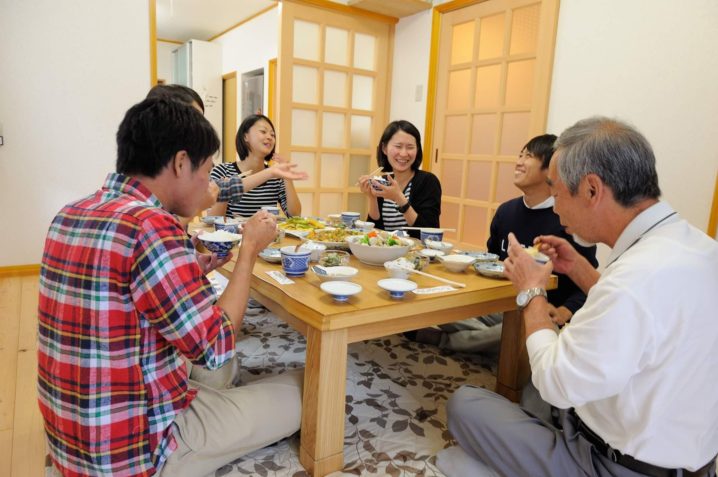
Where is `dining table`? The width and height of the screenshot is (718, 477). dining table is located at coordinates (367, 311).